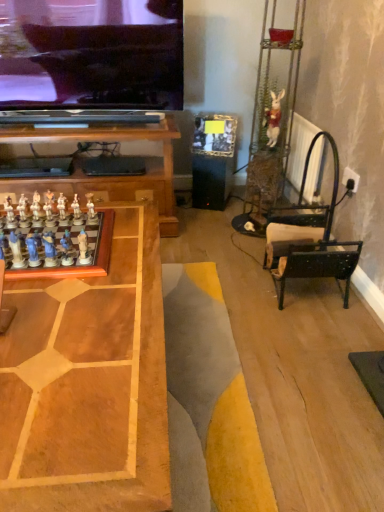
The width and height of the screenshot is (384, 512). I want to click on free space in front of blue glossy chess piece at left, which ranks as the tenth toy in back-to-front order, so click(x=43, y=293).